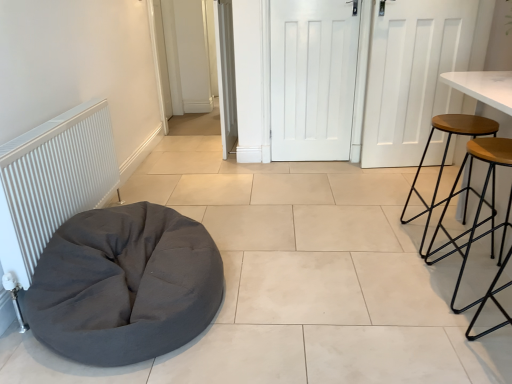
Image resolution: width=512 pixels, height=384 pixels. Identify the location of vacant area that lies between wooden seat stool at right, positioned as the second stool in front-to-back order, and wooden seat stool at right, acting as the second stool starting from the back. (449, 261).